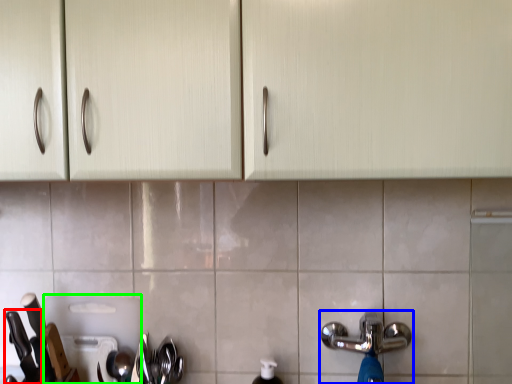
Question: Which object is the farthest from knife (highlighted by a red box)? Choose among these: tap (highlighted by a blue box) or appliance (highlighted by a green box).

Choices:
 (A) tap
 (B) appliance

Answer: (A)